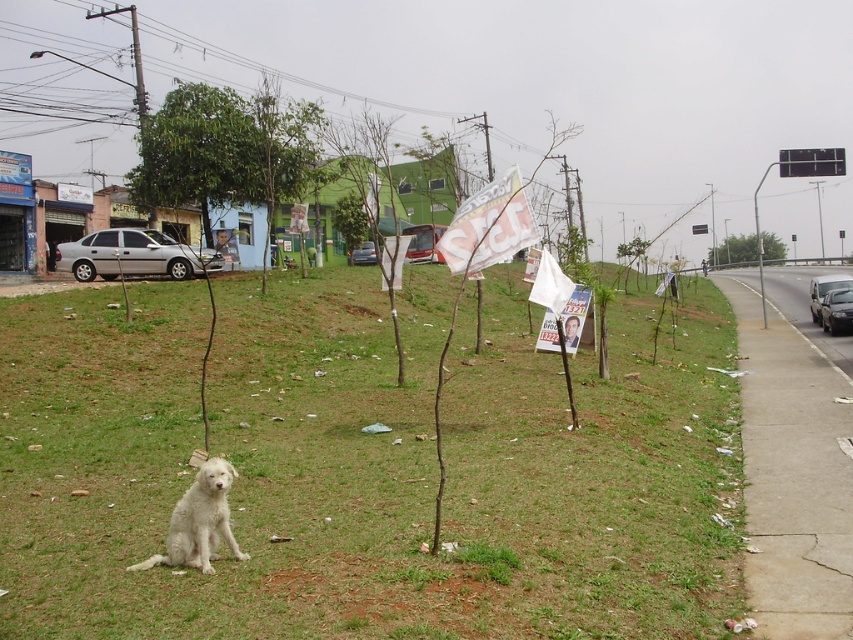
Who is positioned more to the left, green grassy at lower left or white fluffy dog at lower left?

Positioned to the left is white fluffy dog at lower left.

Is green grassy at lower left positioned at the back of white fluffy dog at lower left?

No, it is in front of white fluffy dog at lower left.

This screenshot has height=640, width=853. What are the coordinates of `green grassy at lower left` in the screenshot? It's located at (364, 467).

Image resolution: width=853 pixels, height=640 pixels. I want to click on green grassy at lower left, so click(x=364, y=467).